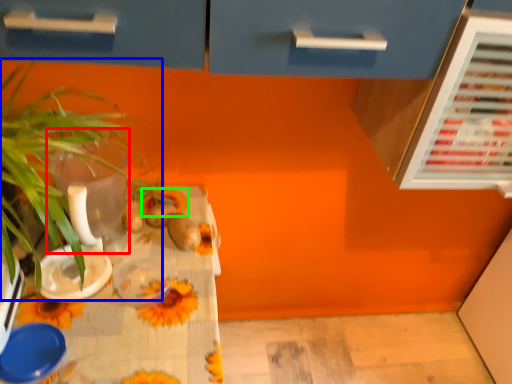
Question: Which object is the closest to the glass vase (highlighted by a red box)? Choose among these: houseplant (highlighted by a blue box) or flower (highlighted by a green box).

Choices:
 (A) houseplant
 (B) flower

Answer: (A)